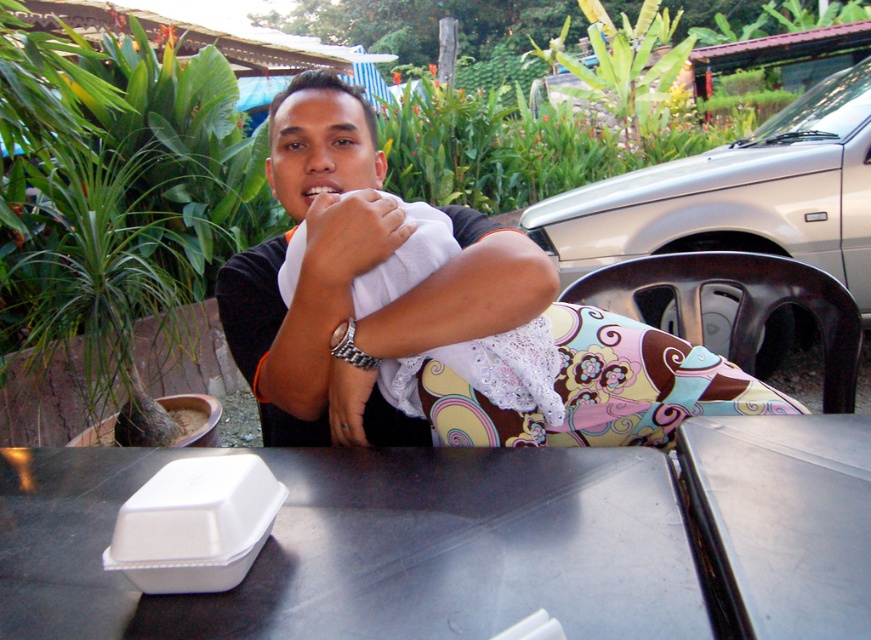
Is point (397, 524) less distant than point (292, 92)?

Yes.

Image resolution: width=871 pixels, height=640 pixels. What do you see at coordinates (368, 547) in the screenshot?
I see `white plastic table at center` at bounding box center [368, 547].

You are a GUI agent. You are given a task and a screenshot of the screen. Output one action in this format:
    pyautogui.click(x=<x>, y=<y>)
    Task: Click on the white plastic table at center
    
    Given the screenshot: What is the action you would take?
    pyautogui.click(x=368, y=547)

Is point (28, 632) less distant than point (790, 461)?

Yes, it is in front of point (790, 461).

Is the position of white plastic table at center more distant than that of metallic silver table at center?

Yes, white plastic table at center is behind metallic silver table at center.

What do you see at coordinates (368, 547) in the screenshot? The image size is (871, 640). I see `white plastic table at center` at bounding box center [368, 547].

Image resolution: width=871 pixels, height=640 pixels. Find the location of `white plastic table at center`. white plastic table at center is located at coordinates (368, 547).

Can you confirm if white plastic table at center is thinner than white fabric at center?

Incorrect, white plastic table at center's width is not less than white fabric at center's.

Can you confirm if white plastic table at center is bigger than white fabric at center?

Indeed, white plastic table at center has a larger size compared to white fabric at center.

Who is more forward, [652,582] or [341,262]?

Point [652,582] is more forward.

Identify the location of white plastic table at center. This screenshot has height=640, width=871. (368, 547).